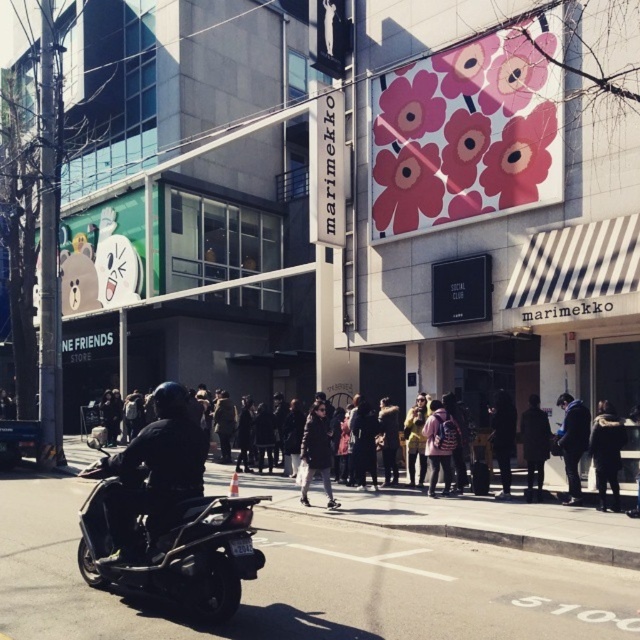
Question: Which point appears closest to the camera in this image?

Choices:
 (A) (531, 500)
 (B) (160, 506)
 (C) (189, 548)

Answer: (C)

Question: Is dark blue helmet at center to the left of dark fabric coat at center from the viewer's perspective?

Choices:
 (A) no
 (B) yes

Answer: (B)

Question: Among these points, which one is nearest to the camera?

Choices:
 (A) (140, 436)
 (B) (152, 572)
 (C) (531, 417)
 (D) (301, 461)

Answer: (B)

Question: Observing the image, what is the correct spatial positioning of dark blue helmet at center in reference to dark fabric coat at center?

Choices:
 (A) right
 (B) left

Answer: (B)

Question: Which of these objects is positioned farthest from the dark blue helmet at center?

Choices:
 (A) dark gray jacket at center
 (B) black matte scooter at lower left

Answer: (A)

Question: Is dark blue helmet at center below dark fabric coat at center?

Choices:
 (A) no
 (B) yes

Answer: (A)